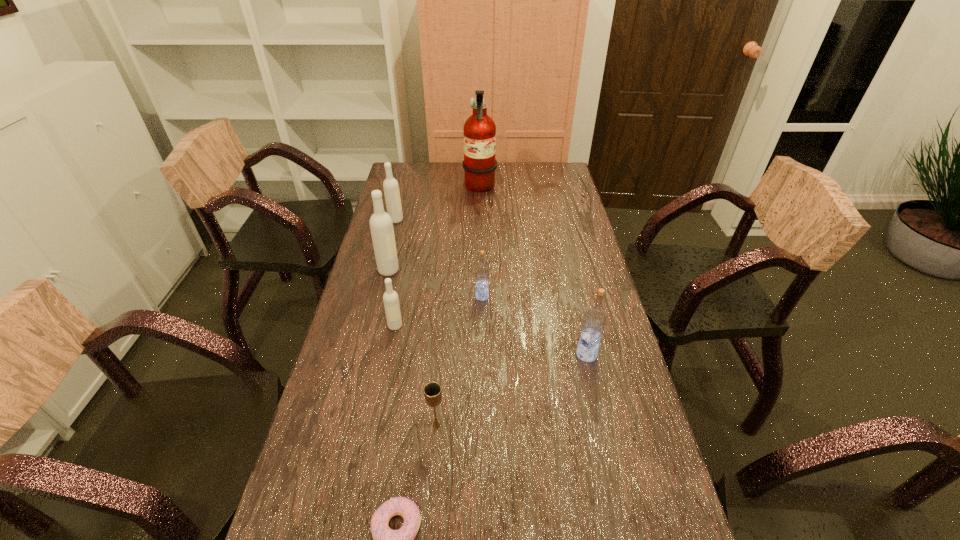
You are a GUI agent. You are given a task and a screenshot of the screen. Output one action in this format:
    pyautogui.click(x=<x>, y=<y>)
    Task: Click on the free spot located on the left of the second shortest object
    This screenshot has height=540, width=960.
    Given the screenshot: What is the action you would take?
    pyautogui.click(x=361, y=425)

This screenshot has width=960, height=540. Identify the location of object at the far edge. 479,164.

The width and height of the screenshot is (960, 540). In order to click on object located in the right edge section of the desktop in this screenshot , I will do pyautogui.click(x=594, y=320).

Identify the location of vacant area at the left edge of the desktop. (334, 377).

Where is `free space at the right edge of the desktop`? The width and height of the screenshot is (960, 540). free space at the right edge of the desktop is located at coordinates (624, 371).

Where is `free space at the far right corner of the desktop`? free space at the far right corner of the desktop is located at coordinates (537, 171).

You are a GUI agent. You are given a task and a screenshot of the screen. Output one action in this format:
    pyautogui.click(x=<x>, y=<y>)
    Task: Click on the unoccupied area between the third nearest object and the left blue vodka
    This screenshot has height=540, width=960.
    Given the screenshot: What is the action you would take?
    pyautogui.click(x=535, y=326)

Find the location of a particular element. This screenshot has height=540, width=960. unoccupied position between the third vodka from right to left and the nearest vodka is located at coordinates (491, 340).

This screenshot has height=540, width=960. I want to click on free space between the seventh shortest object and the fire extinguisher, so click(x=434, y=230).

What are the coordinates of `free space between the second farthest object and the smaller blue vodka` in the screenshot? It's located at (439, 258).